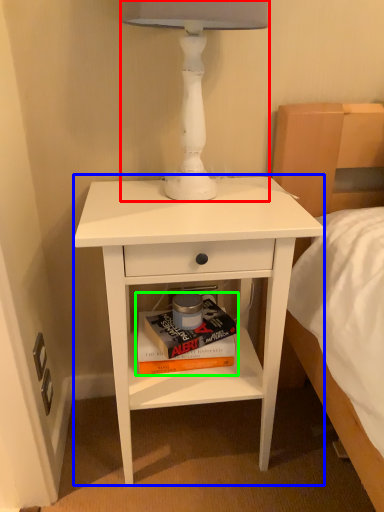
Question: Which object is the farthest from table lamp (highlighted by a red box)? Choose among these: nightstand (highlighted by a blue box) or paperback book (highlighted by a green box).

Choices:
 (A) nightstand
 (B) paperback book

Answer: (B)